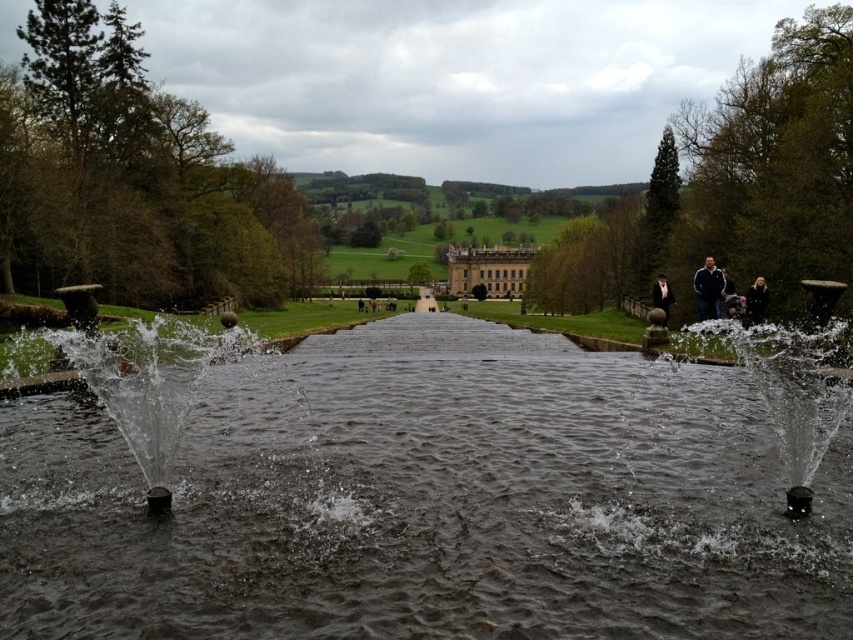
You are standing in the foreground of the serene landscape and want to locate the metallic water at center. Based on the coordinates provided, in which direction should you move relative to your current position?

The metallic water at center is located at coordinates point (154, 387). Since the x coordinate is 0.605, which is greater than 0.5, you should move to the right. The y coordinate is 0.181, which is less than 0.5, so you should move forward. Therefore, move forward and to the right to reach the metallic water at center.

You are standing in the landscape scene and want to place a small boat on the water. Given the position of the dark blue jacket at upper right and the dark gray water at center, where should you place the boat to ensure it is on the water?

You should place the boat on the dark gray water at center, which is located below the dark blue jacket at upper right, ensuring it is on the water.